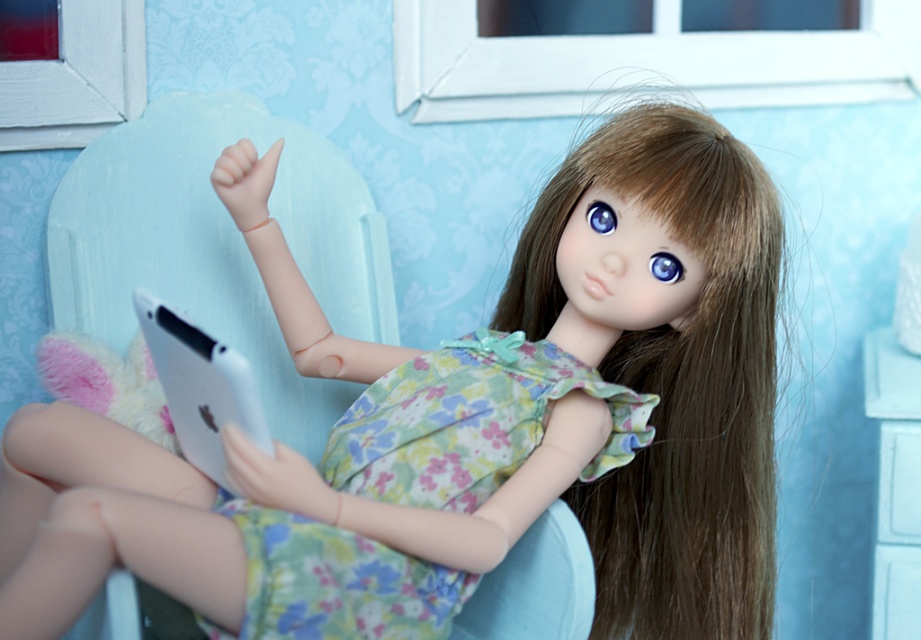
Between brown silky hair at center and floral fabric dress at center, which one appears on the right side from the viewer's perspective?

Positioned to the right is brown silky hair at center.

Is brown silky hair at center thinner than floral fabric dress at center?

Yes, brown silky hair at center is thinner than floral fabric dress at center.

Who is more distant from viewer, (572, 168) or (318, 592)?

The point (572, 168) is behind.

You are a GUI agent. You are given a task and a screenshot of the screen. Output one action in this format:
    pyautogui.click(x=<x>, y=<y>)
    Task: Click on the brown silky hair at center
    The image size is (921, 640).
    Given the screenshot: What is the action you would take?
    pyautogui.click(x=677, y=381)